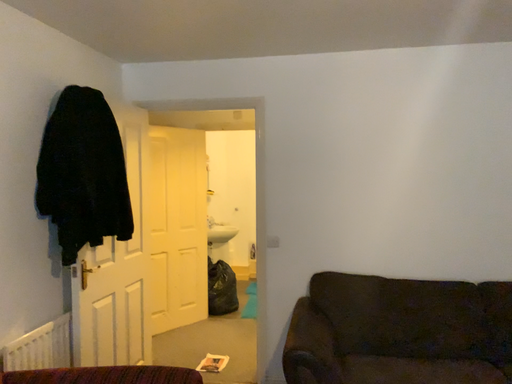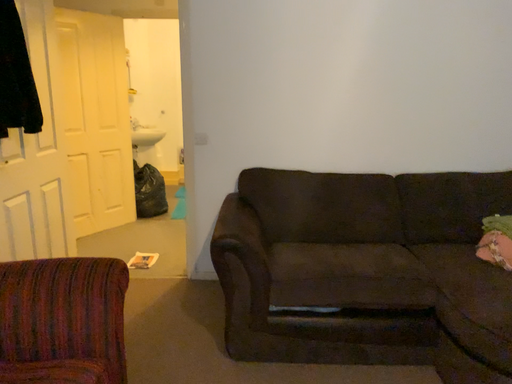
Question: Which way did the camera rotate in the video?

Choices:
 (A) rotated left
 (B) rotated right

Answer: (B)